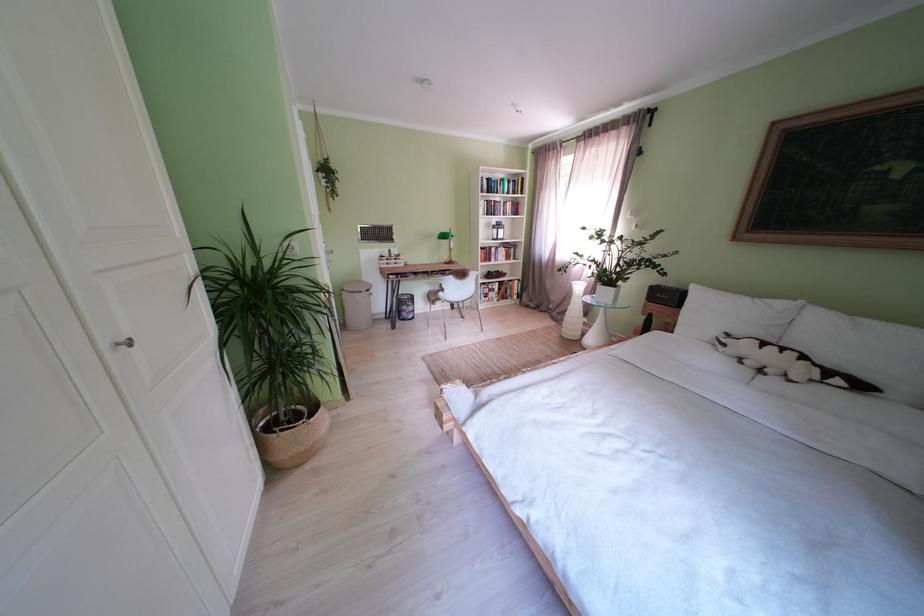
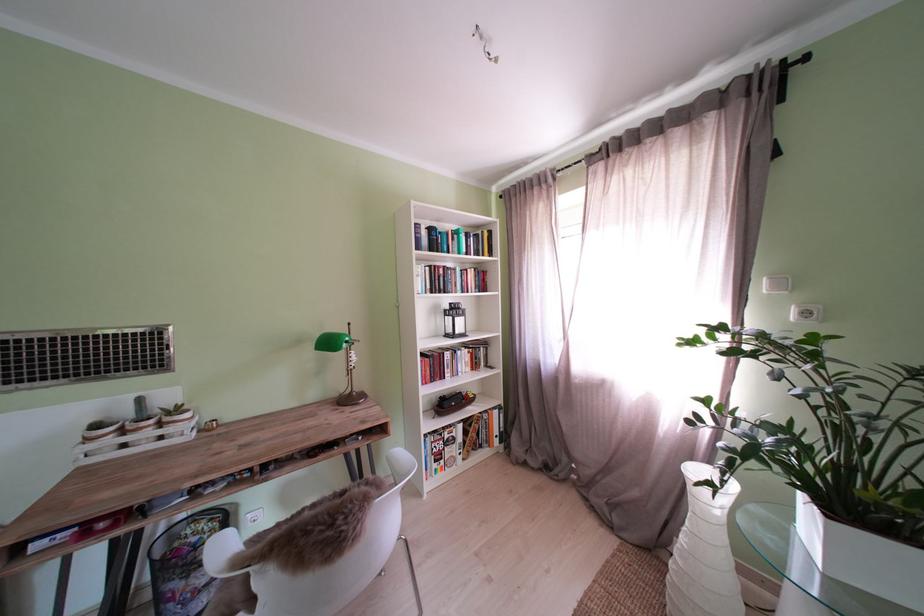
Where in the second image is the point corresponding to (507,296) from the first image?

(470, 444)